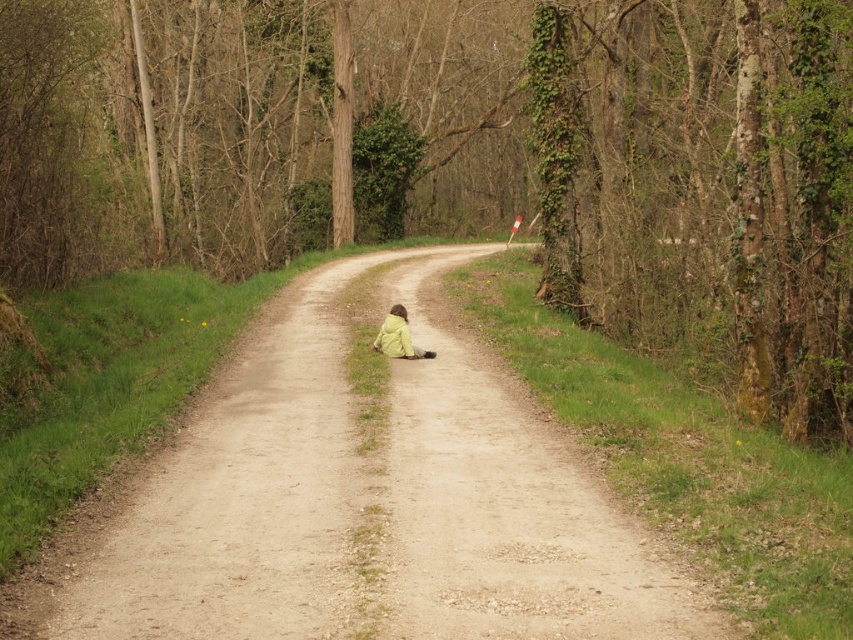
Question: Observing the image, what is the correct spatial positioning of dirt road at center in reference to yellow matte jacket at center?

Choices:
 (A) above
 (B) below

Answer: (B)

Question: Among these objects, which one is farthest from the camera?

Choices:
 (A) dirt road at center
 (B) yellow matte jacket at center

Answer: (B)

Question: Observing the image, what is the correct spatial positioning of dirt road at center in reference to yellow matte jacket at center?

Choices:
 (A) above
 (B) below

Answer: (B)

Question: Does dirt road at center appear under yellow matte jacket at center?

Choices:
 (A) no
 (B) yes

Answer: (B)